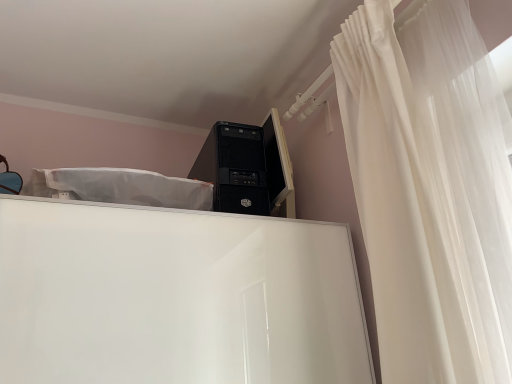
Question: From the image's perspective, is white sheer curtain at upper right located above or below black matte desktop computer at upper center?

Choices:
 (A) above
 (B) below

Answer: (A)

Question: From a real-world perspective, is white sheer curtain at upper right above or below black matte desktop computer at upper center?

Choices:
 (A) below
 (B) above

Answer: (A)

Question: Considering the real-world distances, which object is farthest from the white sheer curtain at upper right?

Choices:
 (A) black matte desktop computer at upper center
 (B) matte black monitor at upper right

Answer: (B)

Question: Which object is the closest to the matte black monitor at upper right?

Choices:
 (A) white sheer curtain at upper right
 (B) black matte desktop computer at upper center

Answer: (B)